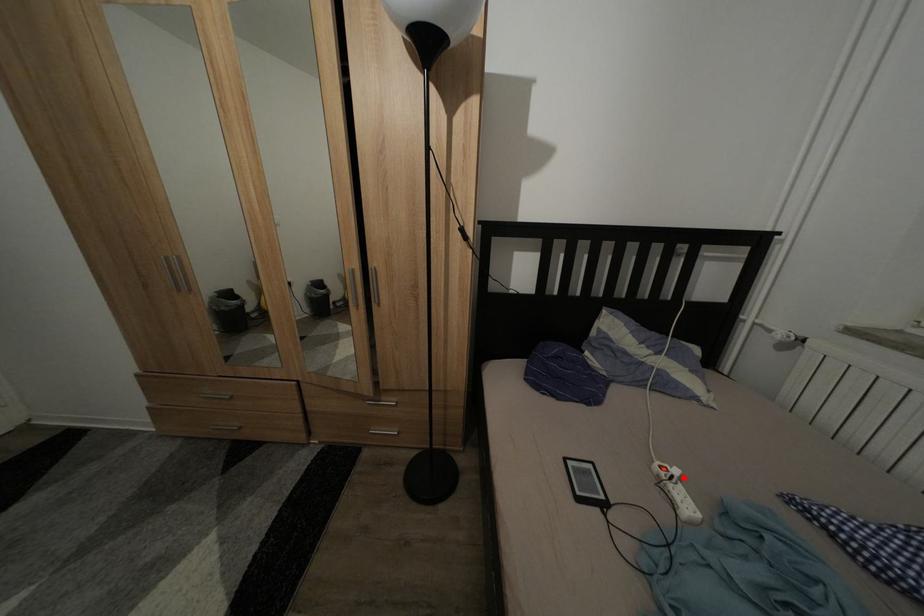
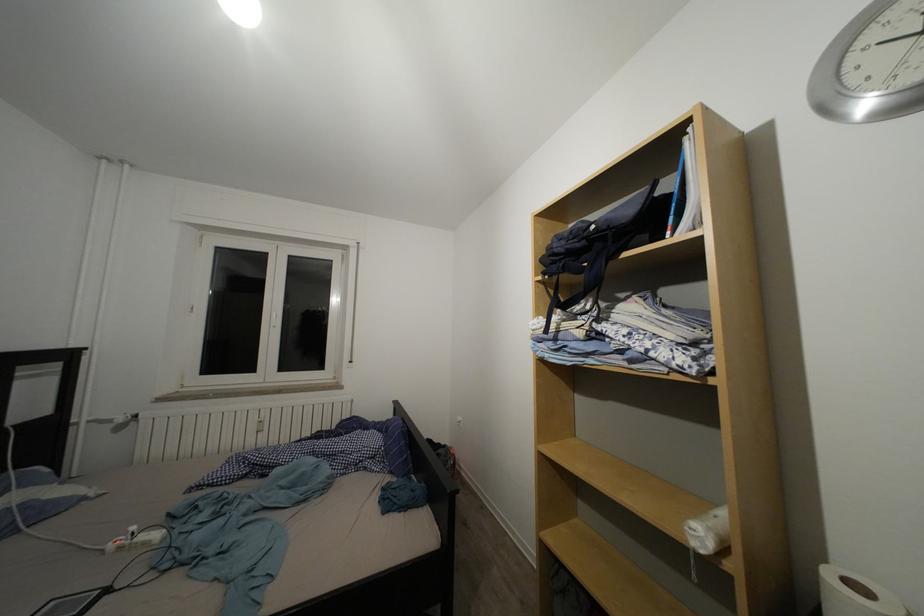
In the second image, find the point that corresponds to the highlighted location in the first image.

(140, 533)